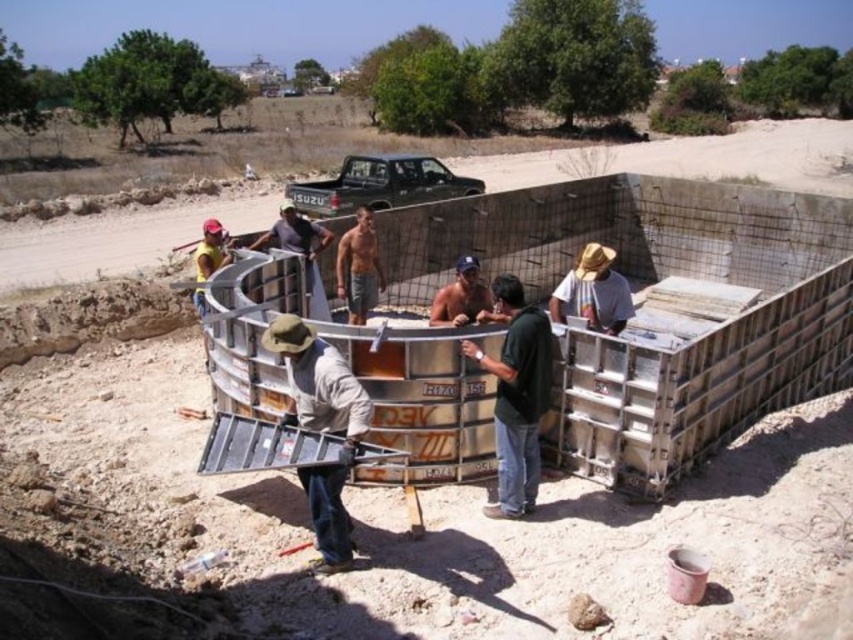
Can you confirm if light brown fabric shirt at center is positioned to the right of shiny metallic helmet at center?

Yes, light brown fabric shirt at center is to the right of shiny metallic helmet at center.

Is light brown fabric shirt at center positioned in front of shiny metallic helmet at center?

Yes, it is.

Between point (338, 545) and point (332, 234), which one is positioned in front?

Point (338, 545) is more forward.

Image resolution: width=853 pixels, height=640 pixels. In order to click on light brown fabric shirt at center in this screenshot , I will do `click(321, 428)`.

Can you confirm if matte black truck at upper center is thinner than shiny metallic helmet at center?

No.

Is point (401, 179) behind point (270, 240)?

Yes.

You are a GUI agent. You are given a task and a screenshot of the screen. Output one action in this format:
    pyautogui.click(x=<x>, y=<y>)
    Task: Click on the matte black truck at upper center
    The width and height of the screenshot is (853, 640).
    Given the screenshot: What is the action you would take?
    pyautogui.click(x=380, y=184)

Locate an element on the screen. matte black truck at upper center is located at coordinates (380, 184).

Is green matte shirt at center wider than shiny metallic shirt at center?

Correct, the width of green matte shirt at center exceeds that of shiny metallic shirt at center.

Where is `green matte shirt at center`? The height and width of the screenshot is (640, 853). green matte shirt at center is located at coordinates (517, 396).